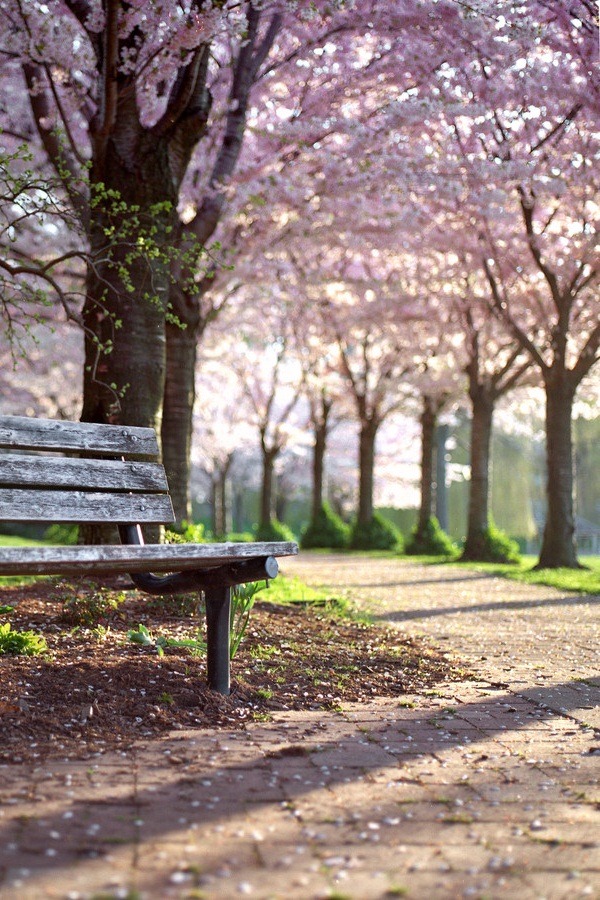
This screenshot has height=900, width=600. Find the location of `seat`. seat is located at coordinates (176, 554).